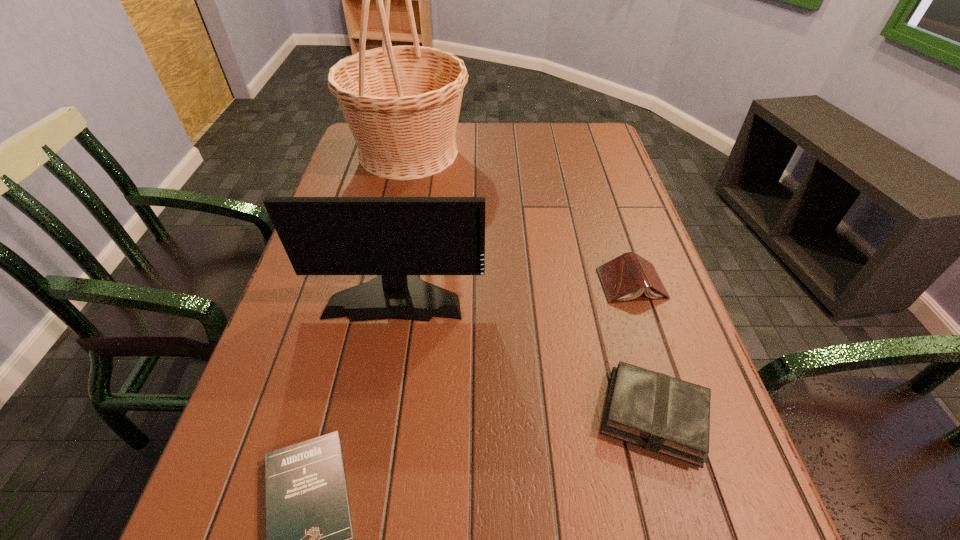
What are the coordinates of `object at the far left corner` in the screenshot? It's located at (402, 103).

This screenshot has height=540, width=960. What are the coordinates of `free space at the far edge` in the screenshot? It's located at (481, 150).

Identify the location of blank space at the near edge of the desktop. The height and width of the screenshot is (540, 960). (518, 539).

In the image, there is a desktop. Find the location of `vacant space at the left edge`. vacant space at the left edge is located at coordinates (330, 416).

You are a GUI agent. You are given a task and a screenshot of the screen. Output one action in this format:
    pyautogui.click(x=<x>, y=<y>)
    Task: Click on the vacant space at the right edge of the desktop
    This screenshot has width=960, height=540.
    Given the screenshot: What is the action you would take?
    [591, 172]

The width and height of the screenshot is (960, 540). What are the coordinates of `vacant area that lies between the tallest object and the farthest book` in the screenshot? It's located at (520, 218).

This screenshot has width=960, height=540. What are the coordinates of `free spot between the monitor and the farthest book` in the screenshot? It's located at (514, 288).

The image size is (960, 540). Identify the location of free space between the farthest book and the tallest object. (520, 218).

The width and height of the screenshot is (960, 540). What are the coordinates of `empty space between the farthest object and the farthest book` in the screenshot? It's located at (520, 218).

Choose which object is the nearest neighbor to the monitor. Please provide its 2D coordinates. Your answer should be formatted as a tuple, i.e. [(x, y)], where the tuple contains the x and y coordinates of a point satisfying the conditions above.

[(660, 413)]